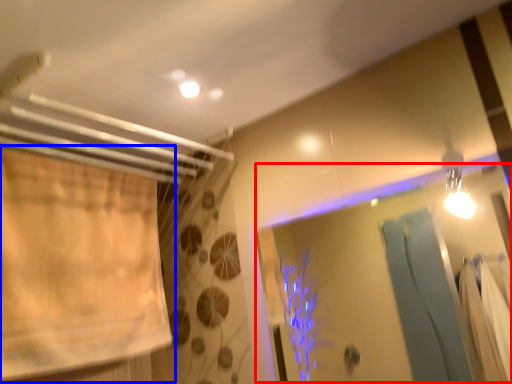
Question: Which of the following is the closest to the observer, screen door (highlighted by a red box) or curtain (highlighted by a blue box)?

Choices:
 (A) screen door
 (B) curtain

Answer: (A)